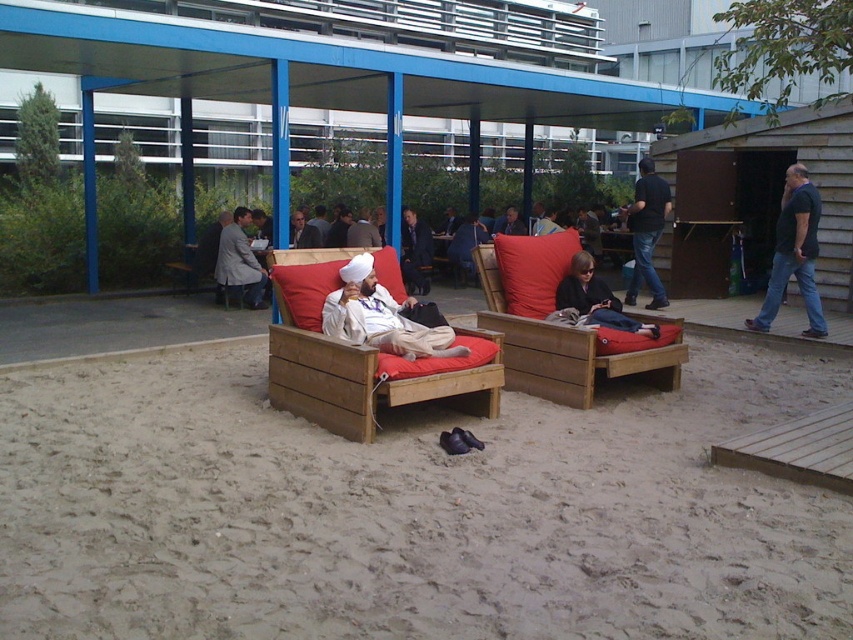
Question: Can you confirm if wooden cushioned couch at center is positioned below matte black jacket at center?

Choices:
 (A) yes
 (B) no

Answer: (A)

Question: In this image, where is sandy beige sand at center located relative to blue metal shelter at center?

Choices:
 (A) right
 (B) left

Answer: (A)

Question: Which object appears closest to the camera in this image?

Choices:
 (A) matte white turban at center
 (B) matte black jacket at center
 (C) wooden lounge chair at center

Answer: (C)

Question: Which point appears farthest from the camera in this image?

Choices:
 (A) (235, 268)
 (B) (527, 244)
 (C) (614, 461)

Answer: (A)

Question: Which of the following is the farthest from the observer?

Choices:
 (A) (300, 244)
 (B) (648, 234)

Answer: (A)

Question: Is the position of dark blue jeans at center less distant than that of matte black jacket at center?

Choices:
 (A) yes
 (B) no

Answer: (B)